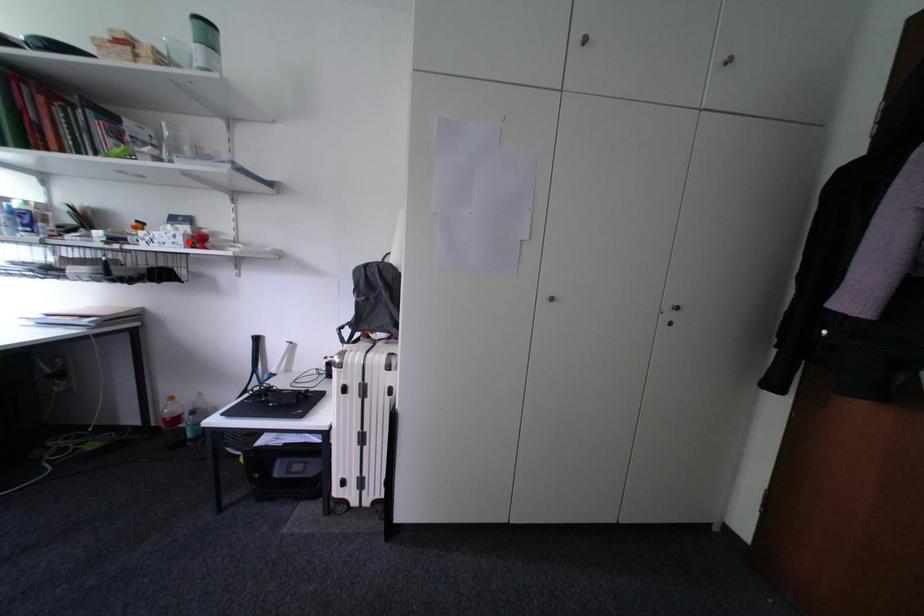
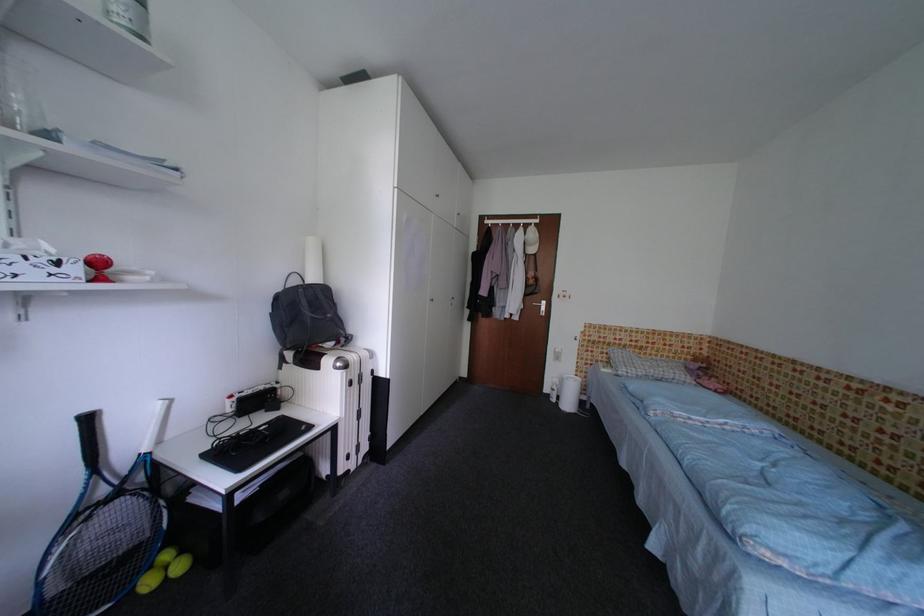
Find the pixel in the second image that matches the highlighted location in the first image.

(83, 272)